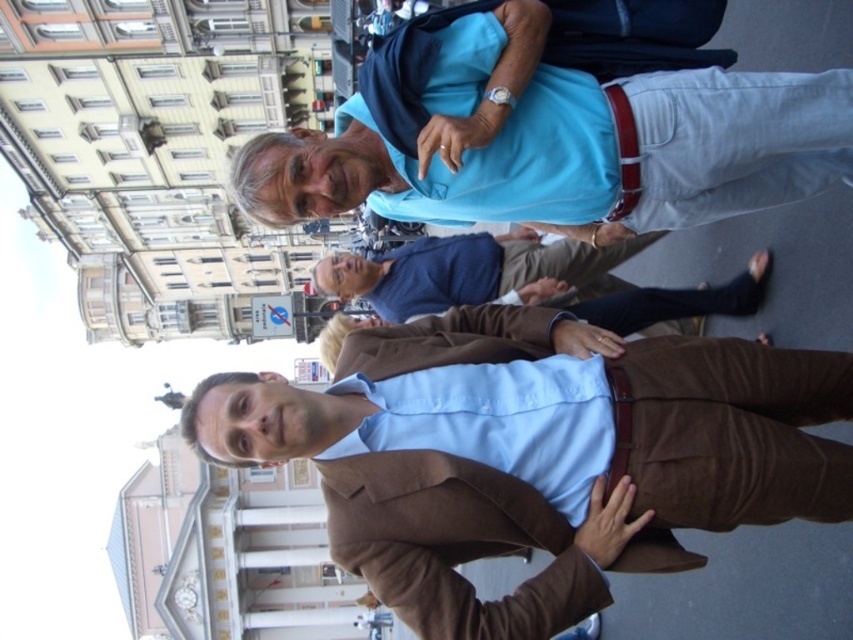
Can you confirm if light blue fabric shirt at upper center is taller than brown leather jacket at center?

Correct, light blue fabric shirt at upper center is much taller as brown leather jacket at center.

Who is higher up, light blue fabric shirt at upper center or brown leather jacket at center?

Positioned higher is light blue fabric shirt at upper center.

Describe the element at coordinates (550, 138) in the screenshot. I see `light blue fabric shirt at upper center` at that location.

This screenshot has height=640, width=853. Find the location of `light blue fabric shirt at upper center`. light blue fabric shirt at upper center is located at coordinates (550, 138).

Is blue cotton shirt at center to the left of brown leather jacket at center from the viewer's perspective?

Correct, you'll find blue cotton shirt at center to the left of brown leather jacket at center.

Is blue cotton shirt at center bigger than brown leather jacket at center?

Yes.

Describe the element at coordinates (469, 272) in the screenshot. Image resolution: width=853 pixels, height=640 pixels. I see `blue cotton shirt at center` at that location.

At what (x,y) coordinates should I click in order to perform the action: click on blue cotton shirt at center. Please return your answer as a coordinate pair (x, y). The width and height of the screenshot is (853, 640). Looking at the image, I should click on (469, 272).

Does light blue fabric shirt at upper center come in front of blue cotton shirt at center?

Yes, it is.

Can you confirm if light blue fabric shirt at upper center is positioned above blue cotton shirt at center?

Correct, light blue fabric shirt at upper center is located above blue cotton shirt at center.

Does point (837, 104) lie in front of point (622, 244)?

Yes, it is.

I want to click on light blue fabric shirt at upper center, so click(550, 138).